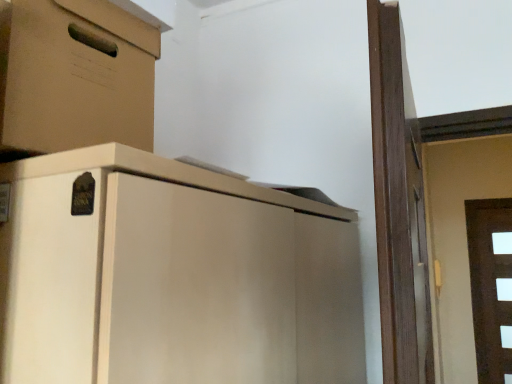
Question: Is white glossy door at right not close to matte cardboard box at upper left?

Choices:
 (A) yes
 (B) no

Answer: (A)

Question: Considering the relative positions of white glossy door at right and matte cardboard box at upper left in the image provided, is white glossy door at right to the left of matte cardboard box at upper left from the viewer's perspective?

Choices:
 (A) no
 (B) yes

Answer: (A)

Question: Does white glossy door at right turn towards matte cardboard box at upper left?

Choices:
 (A) no
 (B) yes

Answer: (A)

Question: From the image's perspective, would you say white glossy door at right is shown under matte cardboard box at upper left?

Choices:
 (A) no
 (B) yes

Answer: (B)

Question: From a real-world perspective, is white glossy door at right positioned over matte cardboard box at upper left based on gravity?

Choices:
 (A) no
 (B) yes

Answer: (A)

Question: Is matte cardboard box at upper left at the back of white glossy door at right?

Choices:
 (A) no
 (B) yes

Answer: (A)

Question: Is matte cardboard box at upper left outside of white glossy door at right?

Choices:
 (A) no
 (B) yes

Answer: (B)

Question: Is the depth of matte cardboard box at upper left less than that of white glossy door at right?

Choices:
 (A) yes
 (B) no

Answer: (A)

Question: Is matte cardboard box at upper left bigger than white glossy door at right?

Choices:
 (A) no
 (B) yes

Answer: (B)

Question: Are matte cardboard box at upper left and white glossy door at right beside each other?

Choices:
 (A) no
 (B) yes

Answer: (A)

Question: Is matte cardboard box at upper left positioned far away from white glossy door at right?

Choices:
 (A) yes
 (B) no

Answer: (A)

Question: From a real-world perspective, is matte cardboard box at upper left physically below white glossy door at right?

Choices:
 (A) yes
 (B) no

Answer: (B)

Question: In terms of width, does matte cardboard box at upper left look wider or thinner when compared to white glossy door at right?

Choices:
 (A) thin
 (B) wide

Answer: (B)